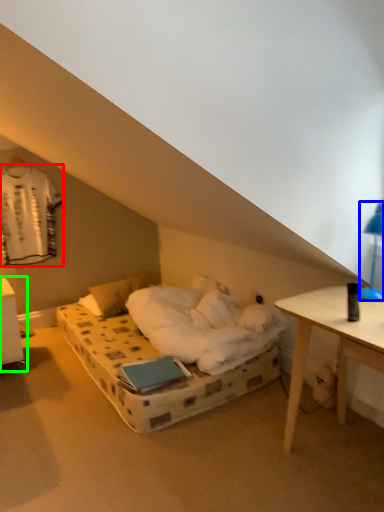
Question: Which object is the closest to the laundry (highlighted by a red box)? Choose among these: bedside lamp (highlighted by a blue box) or nightstand (highlighted by a green box).

Choices:
 (A) bedside lamp
 (B) nightstand

Answer: (B)